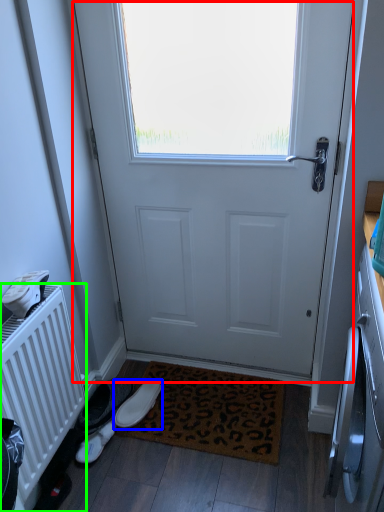
Question: Estimate the real-world distances between objects in this image. Which object is farther from door (highlighted by a red box), footwear (highlighted by a blue box) or radiator (highlighted by a green box)?

Choices:
 (A) footwear
 (B) radiator

Answer: (A)